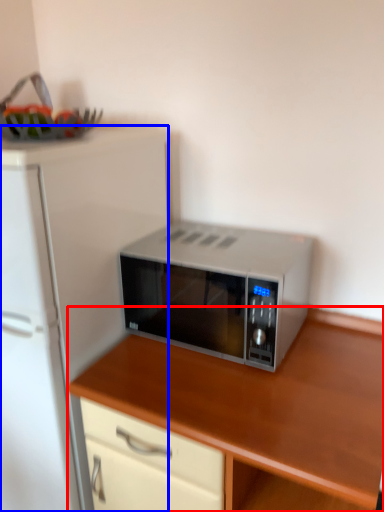
Question: Among these objects, which one is farthest to the camera, cabinetry (highlighted by a red box) or refrigerator (highlighted by a blue box)?

Choices:
 (A) cabinetry
 (B) refrigerator

Answer: (B)